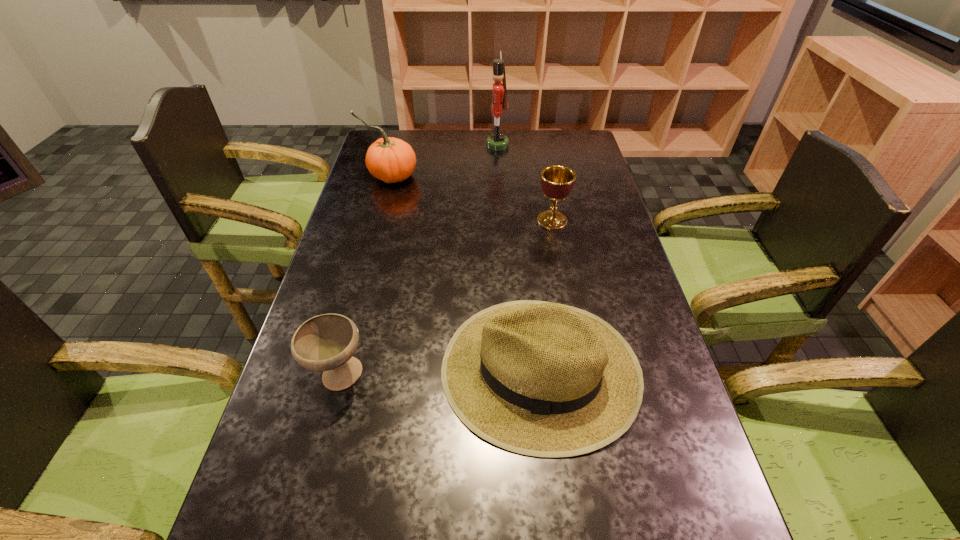
Locate an element on the screen. Image resolution: width=960 pixels, height=540 pixels. vacant area between the left chalice and the right chalice is located at coordinates point(445,298).

I want to click on free space between the right chalice and the pumpkin, so click(x=471, y=198).

Where is `vacant space that is in between the right chalice and the pumpkin`? The height and width of the screenshot is (540, 960). vacant space that is in between the right chalice and the pumpkin is located at coordinates (471, 198).

Identify which object is the nearest to the sunhat. Please provide its 2D coordinates. Your answer should be formatted as a tuple, i.e. [(x, y)], where the tuple contains the x and y coordinates of a point satisfying the conditions above.

[(327, 342)]

You are a GUI agent. You are given a task and a screenshot of the screen. Output one action in this format:
    pyautogui.click(x=<x>, y=<y>)
    Task: Click on the object that stands as the third closest to the sunhat
    
    Given the screenshot: What is the action you would take?
    pyautogui.click(x=389, y=159)

You are a GUI agent. You are given a task and a screenshot of the screen. Output one action in this format:
    pyautogui.click(x=<x>, y=<y>)
    Task: Click on the vacant position in the image that satisfies the following two spatial constraints: 1. on the front-facing side of the third farthest object; 2. on the left side of the tallest object
    The width and height of the screenshot is (960, 540).
    Given the screenshot: What is the action you would take?
    pyautogui.click(x=502, y=220)

Find the location of a particular element. The image size is (960, 540). vacant space that satisfies the following two spatial constraints: 1. on the front-facing side of the farthest object; 2. on the right side of the third farthest object is located at coordinates click(502, 220).